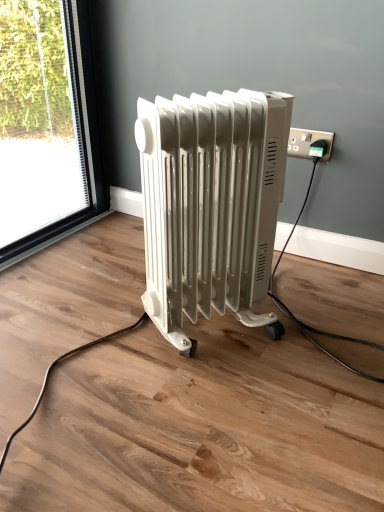
Locate an element on the screen. Image resolution: width=384 pixels, height=512 pixels. free space in front of white glossy radiator at center is located at coordinates (223, 414).